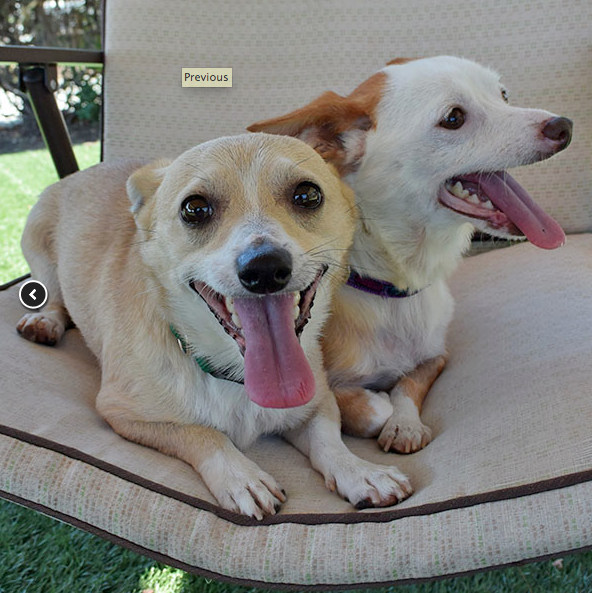
Locate an element on the screen. This screenshot has height=593, width=592. chair arm rest is located at coordinates (64, 56), (5, 56).